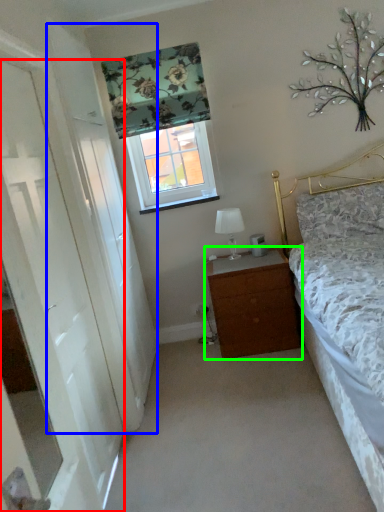
Question: Estimate the real-world distances between objects in this image. Which object is farther from door (highlighted by a red box), screen door (highlighted by a blue box) or chest of drawers (highlighted by a green box)?

Choices:
 (A) screen door
 (B) chest of drawers

Answer: (B)